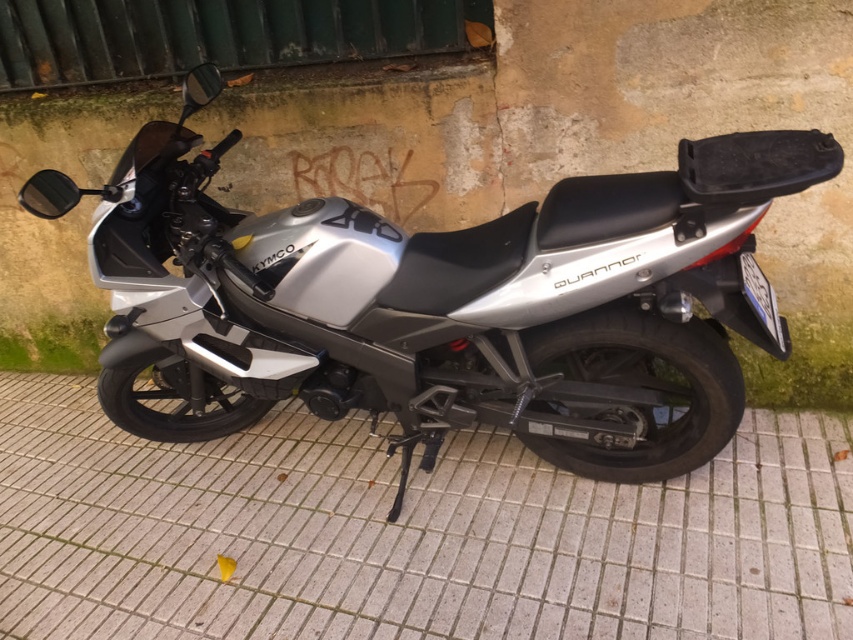
Question: Among these objects, which one is nearest to the camera?

Choices:
 (A) silver metallic motorcycle at center
 (B) white tile pavement at center

Answer: (A)

Question: Does silver metallic motorcycle at center appear over white tile pavement at center?

Choices:
 (A) yes
 (B) no

Answer: (A)

Question: Can you confirm if silver metallic motorcycle at center is wider than white tile pavement at center?

Choices:
 (A) yes
 (B) no

Answer: (B)

Question: Does silver metallic motorcycle at center have a lesser width compared to white tile pavement at center?

Choices:
 (A) no
 (B) yes

Answer: (B)

Question: Among these objects, which one is farthest from the camera?

Choices:
 (A) silver metallic motorcycle at center
 (B) white tile pavement at center

Answer: (B)